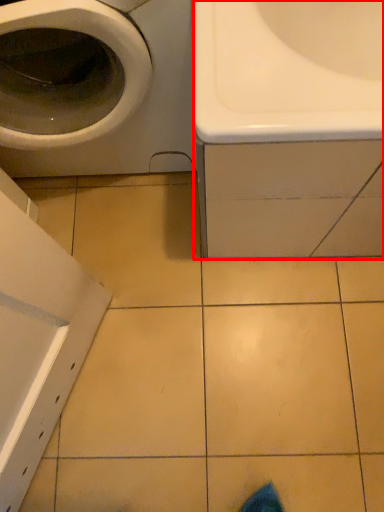
Question: From the image, what is the correct spatial relationship of sink (annotated by the red box) in relation to washing machine?

Choices:
 (A) right
 (B) left

Answer: (A)